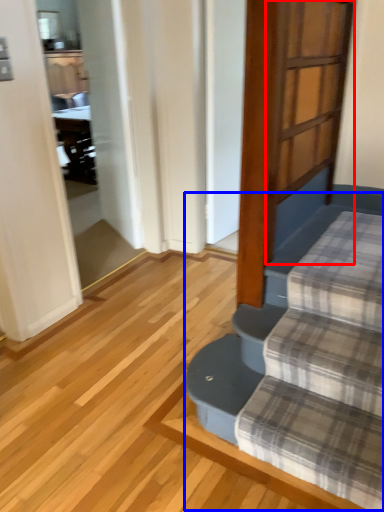
Question: Which of the following is the farthest to the observer, screen door (highlighted by a red box) or stairwell (highlighted by a blue box)?

Choices:
 (A) screen door
 (B) stairwell

Answer: (A)